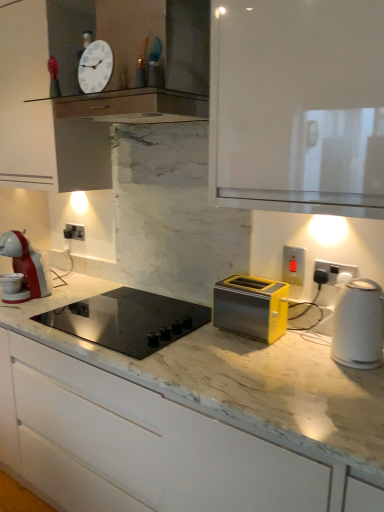
Question: Is satin silver socket at center, the third electric outlet in the right-to-left sequence, at the right side of matte plastic switch at upper right, the 2th electric outlet positioned from the right?

Choices:
 (A) yes
 (B) no

Answer: (B)

Question: Is satin silver socket at center, acting as the 1th electric outlet starting from the left, facing away from matte plastic switch at upper right, which appears as the second electric outlet when viewed from the front?

Choices:
 (A) yes
 (B) no

Answer: (B)

Question: Is matte plastic switch at upper right, the 2th electric outlet in the left-to-right sequence, inside satin silver socket at center, which is the 3th electric outlet in front-to-back order?

Choices:
 (A) no
 (B) yes

Answer: (A)

Question: Could you tell me if satin silver socket at center, the first electric outlet from the back, is facing matte plastic switch at upper right, which appears as the second electric outlet when viewed from the front?

Choices:
 (A) no
 (B) yes

Answer: (A)

Question: From a real-world perspective, does satin silver socket at center, which is the 3th electric outlet in front-to-back order, stand above matte plastic switch at upper right, which appears as the second electric outlet when viewed from the front?

Choices:
 (A) yes
 (B) no

Answer: (B)

Question: Can you confirm if satin silver socket at center, which is the 3th electric outlet in front-to-back order, is bigger than matte plastic switch at upper right, the 2th electric outlet positioned from the right?

Choices:
 (A) yes
 (B) no

Answer: (A)

Question: Considering the relative sizes of matte plastic switch at upper right, which appears as the second electric outlet when viewed from the front, and black glass cooktop at center in the image provided, is matte plastic switch at upper right, which appears as the second electric outlet when viewed from the front, bigger than black glass cooktop at center?

Choices:
 (A) yes
 (B) no

Answer: (B)

Question: Does matte plastic switch at upper right, the 2th electric outlet positioned from the right, turn towards black glass cooktop at center?

Choices:
 (A) yes
 (B) no

Answer: (B)

Question: Is matte plastic switch at upper right, placed as the second electric outlet when sorted from back to front, positioned far away from black glass cooktop at center?

Choices:
 (A) no
 (B) yes

Answer: (A)

Question: Is matte plastic switch at upper right, placed as the second electric outlet when sorted from back to front, shorter than black glass cooktop at center?

Choices:
 (A) no
 (B) yes

Answer: (B)

Question: Is matte plastic switch at upper right, which appears as the second electric outlet when viewed from the front, wider than black glass cooktop at center?

Choices:
 (A) yes
 (B) no

Answer: (B)

Question: Can you confirm if matte plastic switch at upper right, the 2th electric outlet positioned from the right, is thinner than black glass cooktop at center?

Choices:
 (A) yes
 (B) no

Answer: (A)

Question: Is matte plastic switch at upper right, the 2th electric outlet in the left-to-right sequence, thinner than white glossy clock at upper center?

Choices:
 (A) yes
 (B) no

Answer: (A)